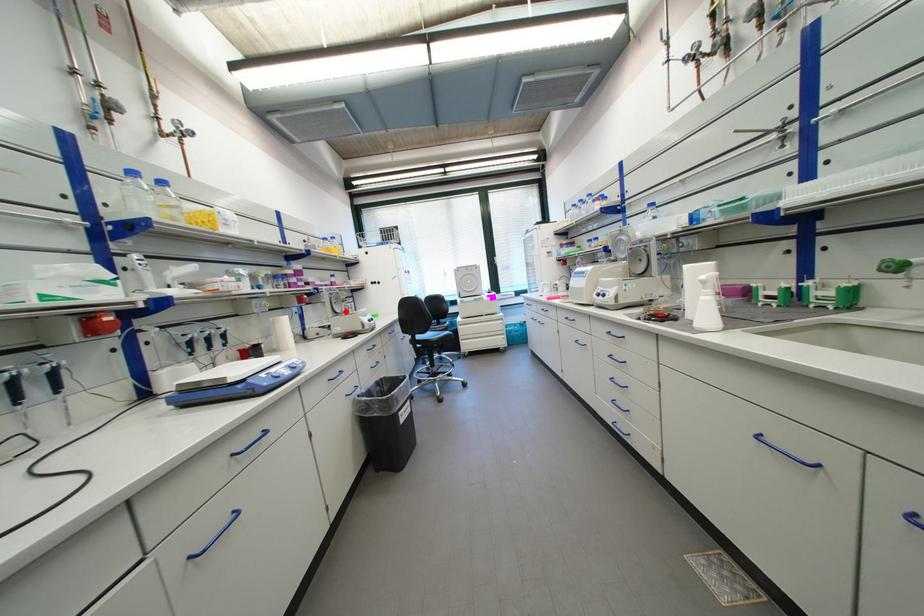
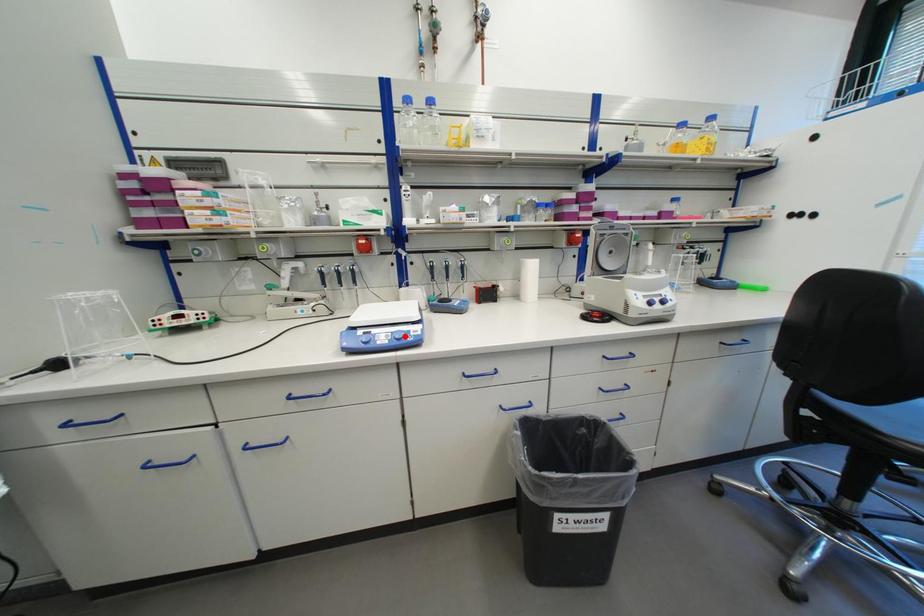
I am providing you with two images of the same scene from different viewpoints. A red point is marked on the first image and another point is marked on the second image. Is the marked point in image1 the same physical position as the marked point in image2?

No